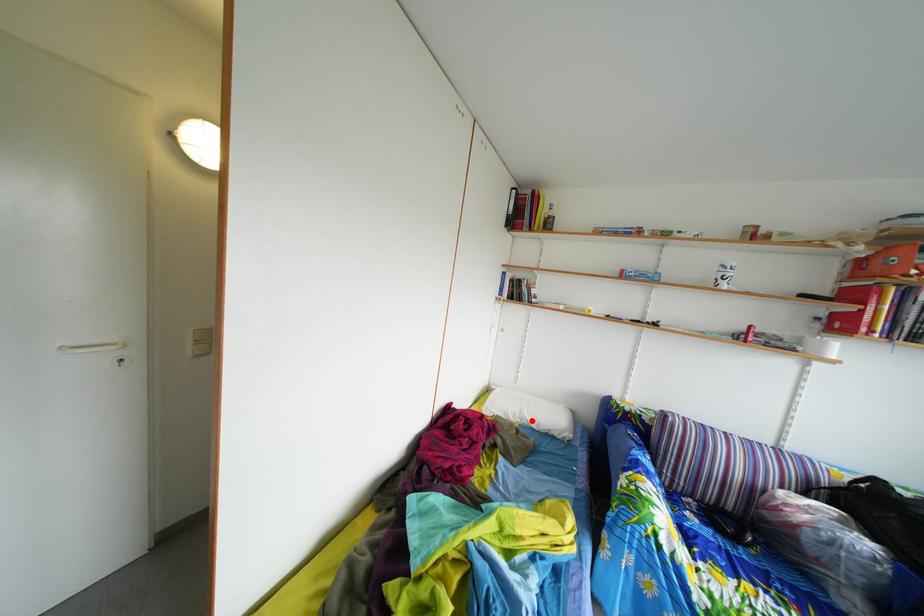
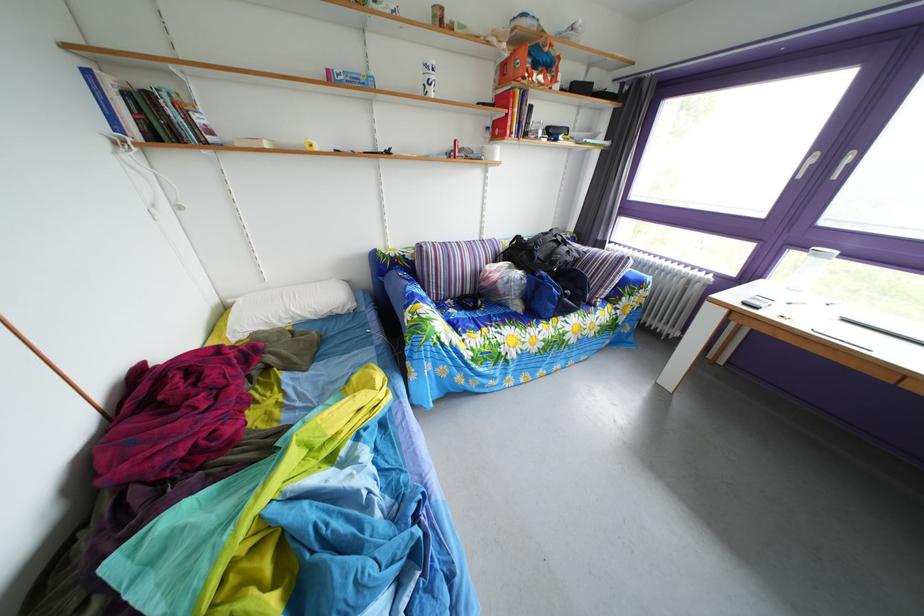
Question: I am providing you with two images of the same scene from different viewpoints. Image1 has a red point marked. In image2, the corresponding 3D location appears at what relative position? Reply with the corresponding letter.

Choices:
 (A) Closer
 (B) Farther

Answer: (A)